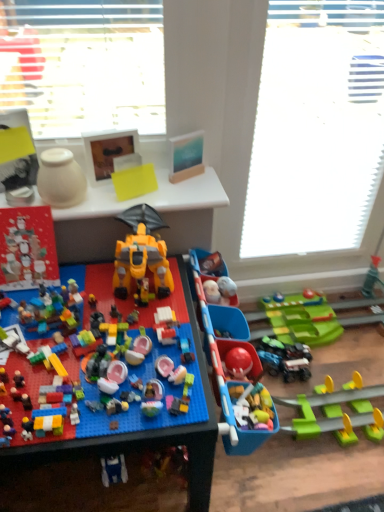
Question: Should I look upward or downward to see yellow plastic robot at center, acting as the second toy starting from the right?

Choices:
 (A) down
 (B) up

Answer: (A)

Question: From the image's perspective, is yellow plastic table at upper center on matte red advent calendar at left, the fifth toy when ordered from right to left?

Choices:
 (A) no
 (B) yes

Answer: (B)

Question: Does yellow plastic table at upper center appear on the left side of matte red advent calendar at left, the 1th toy in the left-to-right sequence?

Choices:
 (A) yes
 (B) no

Answer: (B)

Question: Can you confirm if yellow plastic table at upper center is shorter than matte red advent calendar at left, the fifth toy when ordered from right to left?

Choices:
 (A) no
 (B) yes

Answer: (B)

Question: Can you confirm if yellow plastic table at upper center is smaller than matte red advent calendar at left, the 1th toy in the left-to-right sequence?

Choices:
 (A) yes
 (B) no

Answer: (B)

Question: Can you confirm if yellow plastic table at upper center is wider than matte red advent calendar at left, the 1th toy in the left-to-right sequence?

Choices:
 (A) yes
 (B) no

Answer: (A)

Question: Considering the relative sizes of yellow plastic table at upper center and matte red advent calendar at left, the fifth toy when ordered from right to left, in the image provided, is yellow plastic table at upper center bigger than matte red advent calendar at left, the fifth toy when ordered from right to left,?

Choices:
 (A) no
 (B) yes

Answer: (B)

Question: Is matte red advent calendar at left, the 1th toy in the left-to-right sequence, aimed at white textured window screen at upper center?

Choices:
 (A) yes
 (B) no

Answer: (B)

Question: Is matte red advent calendar at left, the 1th toy in the left-to-right sequence, to the right of white textured window screen at upper center from the viewer's perspective?

Choices:
 (A) yes
 (B) no

Answer: (B)

Question: From the image's perspective, is matte red advent calendar at left, the fifth toy when ordered from right to left, under white textured window screen at upper center?

Choices:
 (A) yes
 (B) no

Answer: (A)

Question: Can you see matte red advent calendar at left, the fifth toy when ordered from right to left, touching white textured window screen at upper center?

Choices:
 (A) yes
 (B) no

Answer: (B)

Question: Is matte red advent calendar at left, the 1th toy in the left-to-right sequence, outside white textured window screen at upper center?

Choices:
 (A) yes
 (B) no

Answer: (A)

Question: From the image's perspective, is matte red advent calendar at left, the 1th toy in the left-to-right sequence, on top of white textured window screen at upper center?

Choices:
 (A) yes
 (B) no

Answer: (B)

Question: Considering the relative sizes of white matte vase at upper left, arranged as the 4th toy when viewed from the right, and yellow plastic robot at center, acting as the second toy starting from the right, in the image provided, is white matte vase at upper left, arranged as the 4th toy when viewed from the right, wider than yellow plastic robot at center, acting as the second toy starting from the right,?

Choices:
 (A) yes
 (B) no

Answer: (B)